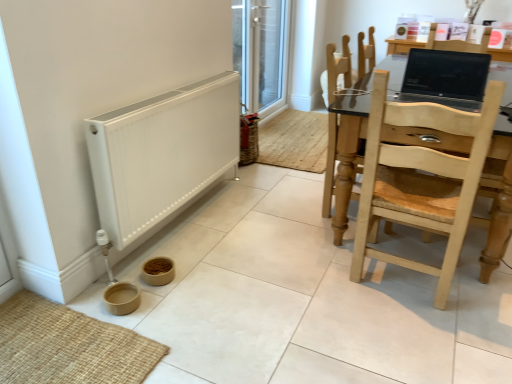
Where is `vacant area that lies to the right of light wood chair at right, the second chair from the back`? vacant area that lies to the right of light wood chair at right, the second chair from the back is located at coordinates (480, 280).